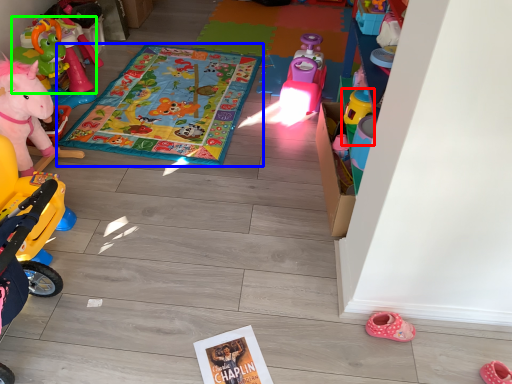
Question: Which is nearer to the toy (highlighted by a red box)? blanket (highlighted by a blue box) or toy (highlighted by a green box).

Choices:
 (A) blanket
 (B) toy

Answer: (A)